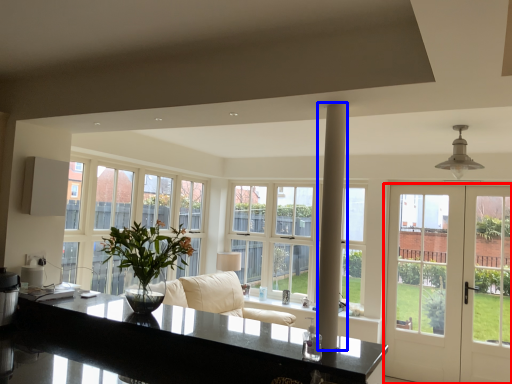
Question: Which object is closer to the camera taking this photo, door (highlighted by a red box) or pillar (highlighted by a blue box)?

Choices:
 (A) door
 (B) pillar

Answer: (B)